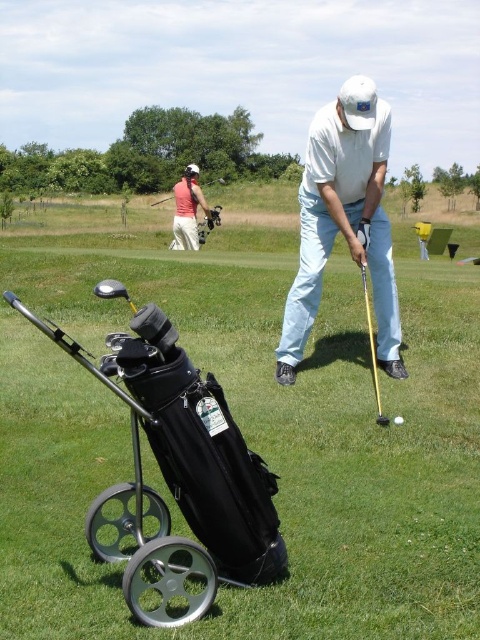
Question: Does matte pink shirt at upper left appear on the right side of matte black golf club at center?

Choices:
 (A) no
 (B) yes

Answer: (B)

Question: Estimate the real-world distances between objects in this image. Which object is closer to the matte black golf club at center?

Choices:
 (A) metallic gold shaft at center
 (B) white matte golf ball at center

Answer: (A)

Question: Which of the following is the closest to the observer?

Choices:
 (A) (357, 83)
 (B) (399, 420)

Answer: (B)

Question: Does matte pink shirt at upper left appear over matte black golf club at center?

Choices:
 (A) yes
 (B) no

Answer: (B)

Question: Estimate the real-world distances between objects in this image. Which object is closer to the white matte golf ball at center?

Choices:
 (A) matte black golf club at center
 (B) metallic gold shaft at center

Answer: (B)

Question: Is white matte golf club at center to the left of matte pink shirt at upper left from the viewer's perspective?

Choices:
 (A) yes
 (B) no

Answer: (B)